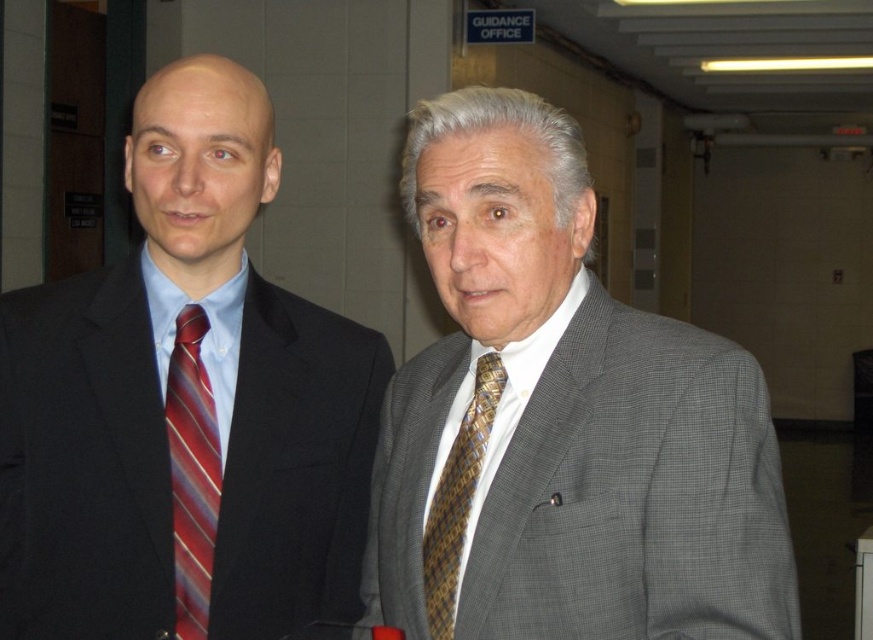
Question: Which point is farther from the camera taking this photo?

Choices:
 (A) (452, 556)
 (B) (538, 429)
 (C) (88, 384)

Answer: (C)

Question: Is striped silk tie at left smaller than brown woven tie at center?

Choices:
 (A) yes
 (B) no

Answer: (B)

Question: Observing the image, what is the correct spatial positioning of gray textured suit at center in reference to striped silk tie at left?

Choices:
 (A) left
 (B) right

Answer: (B)

Question: Which object is closer to the camera taking this photo?

Choices:
 (A) gray textured suit at center
 (B) matte black suit at left

Answer: (A)

Question: Which of the following is the farthest from the observer?

Choices:
 (A) (566, 138)
 (B) (262, 451)
 (C) (214, 532)
 (D) (447, 481)

Answer: (B)

Question: Can you confirm if striped silk tie at left is positioned above brown woven tie at center?

Choices:
 (A) yes
 (B) no

Answer: (A)